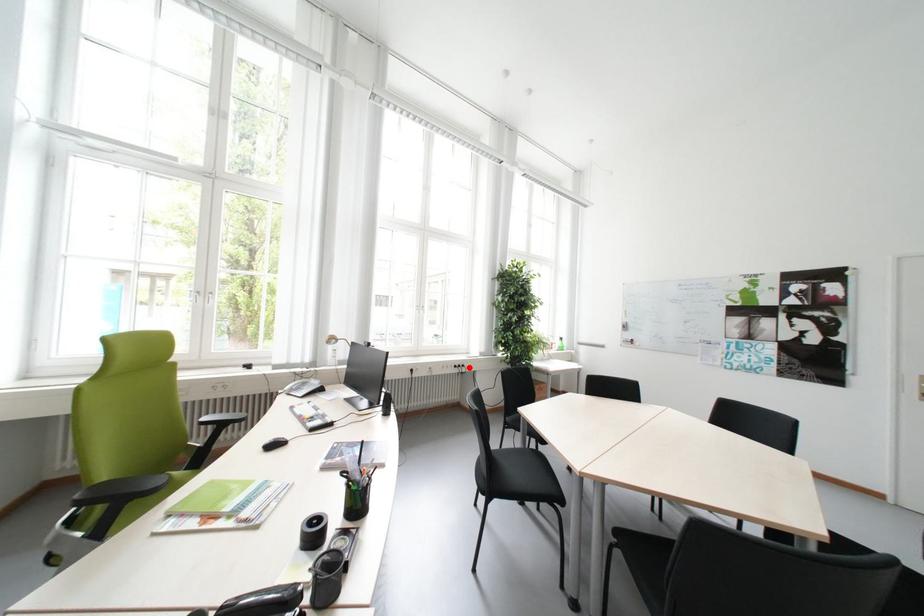
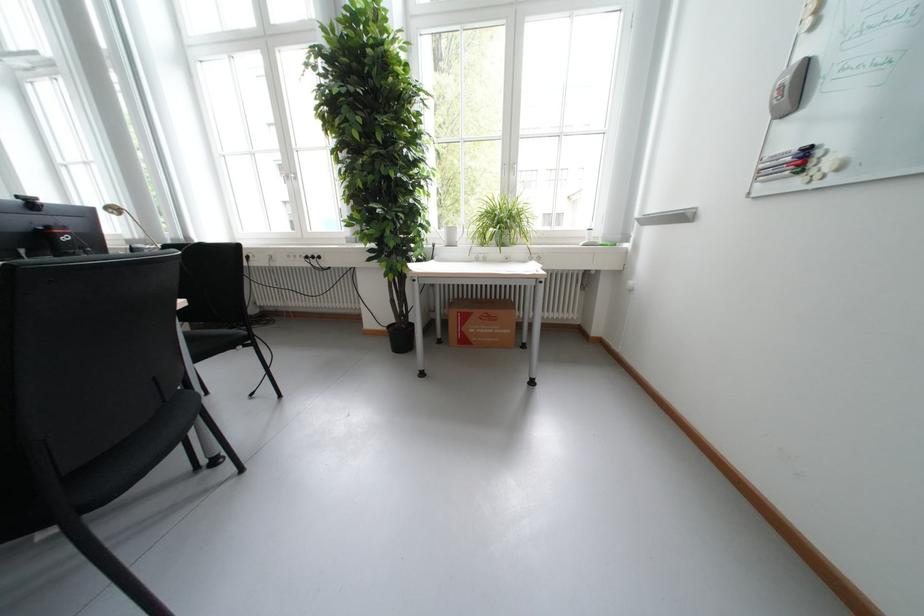
In the second image, find the point that corresponds to the highlighted location in the first image.

(322, 257)